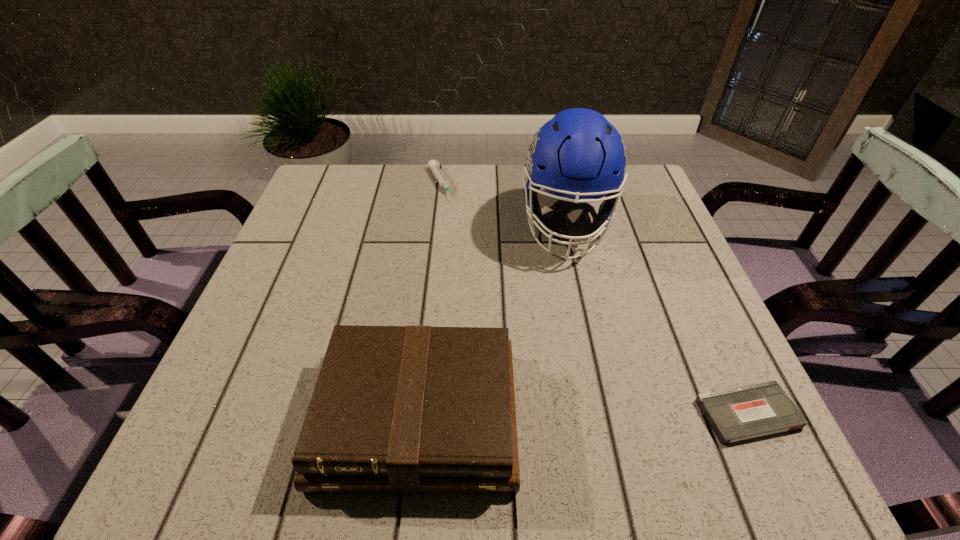
Locate an element on the screen. vacant spot on the desktop that is between the second tallest object and the shortest object and is positioned on the face guard of the second object from right to left is located at coordinates (566, 415).

Image resolution: width=960 pixels, height=540 pixels. I want to click on free space on the desktop that is between the second tallest object and the rightmost object and is positioned at the needle end of the second shortest object, so click(576, 415).